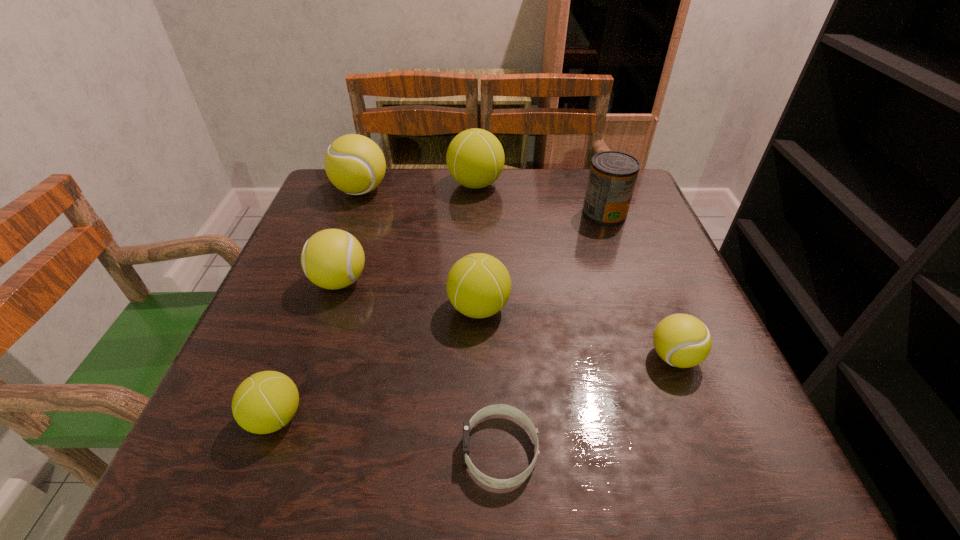
Find the location of a particular element. vacant point located between the farthest yellow tennis ball and the farthest green tennis ball is located at coordinates (419, 187).

Where is `free area in between the second smallest green tennis ball and the biggest green tennis ball`? The width and height of the screenshot is (960, 540). free area in between the second smallest green tennis ball and the biggest green tennis ball is located at coordinates (477, 246).

Locate an element on the screen. Image resolution: width=960 pixels, height=540 pixels. empty space that is in between the can and the rightmost yellow tennis ball is located at coordinates (639, 285).

Find the location of a particular element. Image resolution: width=960 pixels, height=540 pixels. free space that is in between the second farthest yellow tennis ball and the biggest green tennis ball is located at coordinates (408, 233).

Find the location of a particular element. Image resolution: width=960 pixels, height=540 pixels. object identified as the fifth closest to the wristband is located at coordinates coord(612,177).

This screenshot has height=540, width=960. Find the location of `the fourth closest object relative to the second smallest green tennis ball`. the fourth closest object relative to the second smallest green tennis ball is located at coordinates (266, 401).

You are a GUI agent. You are given a task and a screenshot of the screen. Output one action in this format:
    pyautogui.click(x=<x>, y=<y>)
    Task: Click on the tennis ball that stands as the fourth closest to the red can
    
    Given the screenshot: What is the action you would take?
    click(x=354, y=164)

Choose which tennis ball is the second nearest neighbor to the second farthest green tennis ball. Please provide its 2D coordinates. Your answer should be formatted as a tuple, i.e. [(x, y)], where the tuple contains the x and y coordinates of a point satisfying the conditions above.

[(681, 340)]

Identify which yellow tennis ball is the third closest to the second nearest green tennis ball. Please provide its 2D coordinates. Your answer should be formatted as a tuple, i.e. [(x, y)], where the tuple contains the x and y coordinates of a point satisfying the conditions above.

[(354, 164)]

Identify which yellow tennis ball is located as the nearest to the smallest green tennis ball. Please provide its 2D coordinates. Your answer should be formatted as a tuple, i.e. [(x, y)], where the tuple contains the x and y coordinates of a point satisfying the conditions above.

[(332, 259)]